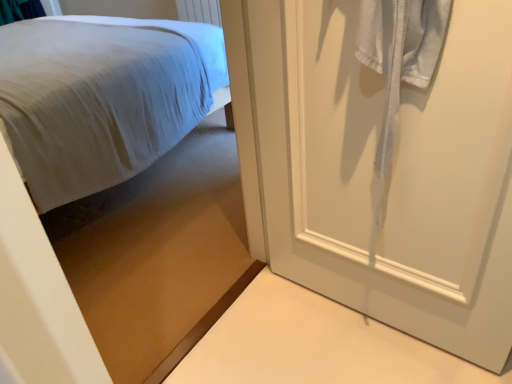
Question: From the image's perspective, is matte white bed at upper left, which is the first bed in front-to-back order, above white matte door at right?

Choices:
 (A) yes
 (B) no

Answer: (A)

Question: Is matte white bed at upper left, which is the first bed in front-to-back order, positioned with its back to white matte door at right?

Choices:
 (A) yes
 (B) no

Answer: (B)

Question: Does matte white bed at upper left, the second bed from the back, appear on the right side of white matte door at right?

Choices:
 (A) yes
 (B) no

Answer: (B)

Question: Does matte white bed at upper left, the second bed from the back, have a greater width compared to white matte door at right?

Choices:
 (A) yes
 (B) no

Answer: (A)

Question: Is white matte door at right located within matte white bed at upper left, the second bed from the back?

Choices:
 (A) no
 (B) yes

Answer: (A)

Question: Is there a large distance between matte white bed at upper left, which is the first bed in front-to-back order, and white matte door at right?

Choices:
 (A) no
 (B) yes

Answer: (A)

Question: Does white fabric bed at left, which is counted as the first bed, starting from the back, have a lesser height compared to matte white bed at upper left, which is the first bed in front-to-back order?

Choices:
 (A) no
 (B) yes

Answer: (B)

Question: Considering the relative sizes of white fabric bed at left, marked as the second bed in a front-to-back arrangement, and matte white bed at upper left, the second bed from the back, in the image provided, is white fabric bed at left, marked as the second bed in a front-to-back arrangement, wider than matte white bed at upper left, the second bed from the back,?

Choices:
 (A) yes
 (B) no

Answer: (A)

Question: Considering the relative positions of white fabric bed at left, which is counted as the first bed, starting from the back, and matte white bed at upper left, the second bed from the back, in the image provided, is white fabric bed at left, which is counted as the first bed, starting from the back, to the right of matte white bed at upper left, the second bed from the back, from the viewer's perspective?

Choices:
 (A) no
 (B) yes

Answer: (A)

Question: Is white fabric bed at left, marked as the second bed in a front-to-back arrangement, behind matte white bed at upper left, which is the first bed in front-to-back order?

Choices:
 (A) no
 (B) yes

Answer: (B)

Question: From the image's perspective, is white fabric bed at left, marked as the second bed in a front-to-back arrangement, under matte white bed at upper left, which is the first bed in front-to-back order?

Choices:
 (A) no
 (B) yes

Answer: (A)

Question: Would you say white fabric bed at left, which is counted as the first bed, starting from the back, contains matte white bed at upper left, the second bed from the back?

Choices:
 (A) yes
 (B) no

Answer: (B)

Question: Is white matte door at right taller than white fabric bed at left, marked as the second bed in a front-to-back arrangement?

Choices:
 (A) no
 (B) yes

Answer: (B)